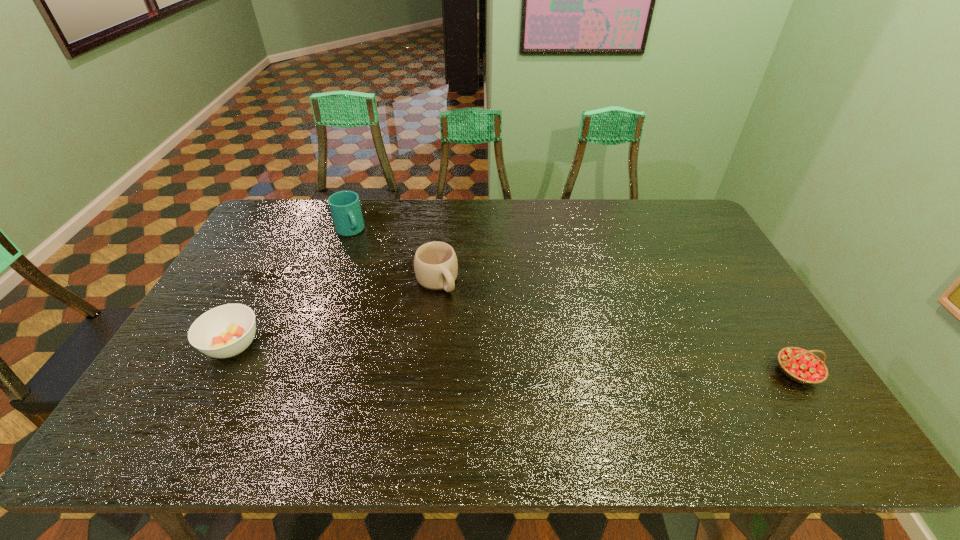
Find the location of a particular element. the leftmost object is located at coordinates (x=227, y=330).

In order to click on strawberry in this screenshot , I will do `click(802, 366)`.

The width and height of the screenshot is (960, 540). I want to click on the second object from left to right, so click(345, 208).

At what (x,y) coordinates should I click in order to perform the action: click on the farthest object. Please return your answer as a coordinate pair (x, y). The width and height of the screenshot is (960, 540). Looking at the image, I should click on (345, 208).

Where is `the second tallest object`? the second tallest object is located at coordinates (435, 263).

The image size is (960, 540). Find the location of `the third nearest object`. the third nearest object is located at coordinates (435, 263).

Locate an element on the screen. Image resolution: width=960 pixels, height=540 pixels. blank space located 0.120m on the back of the soup bowl is located at coordinates (260, 293).

You are a GUI agent. You are given a task and a screenshot of the screen. Output one action in this format:
    pyautogui.click(x=<x>, y=<y>)
    Task: Click on the vacant space located on the back of the rightmost object
    
    Given the screenshot: What is the action you would take?
    pyautogui.click(x=727, y=263)

The width and height of the screenshot is (960, 540). Identify the location of vacant space located on the handle side of the farthest object. [x=362, y=251].

Find the location of a particular element. The height and width of the screenshot is (540, 960). vacant space located 0.080m on the handle side of the farthest object is located at coordinates (363, 252).